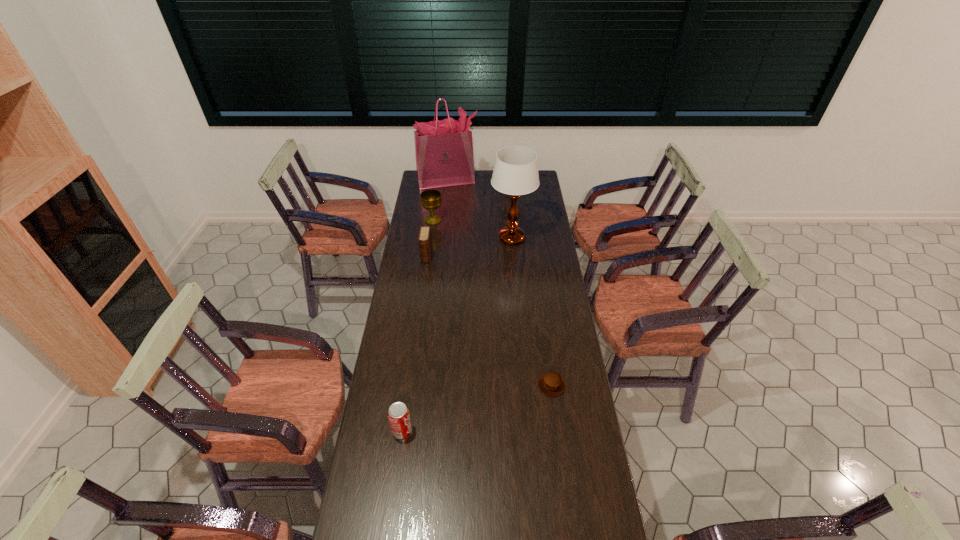
Find the location of a particular element. the farthest object is located at coordinates (444, 156).

Image resolution: width=960 pixels, height=540 pixels. Identify the location of table lamp. (515, 173).

At what (x,y) coordinates should I click in order to perform the action: click on chalice. Please return your answer as a coordinate pair (x, y). This screenshot has width=960, height=540. Looking at the image, I should click on (430, 199).

Identify the location of diary. Image resolution: width=960 pixels, height=540 pixels. (425, 241).

Where is `the nearest object`? The width and height of the screenshot is (960, 540). the nearest object is located at coordinates (399, 418).

This screenshot has height=540, width=960. Identify the location of the fifth farthest object. pyautogui.click(x=552, y=384).

Identify the location of the shortest object. Image resolution: width=960 pixels, height=540 pixels. (552, 384).

Where is `free space located 0.240m on the right of the shopping bag`? free space located 0.240m on the right of the shopping bag is located at coordinates (516, 180).

Identify the location of vacant space situated 0.300m on the front of the table lamp. (516, 294).

Locate an element on the screen. This screenshot has width=960, height=540. vacant space situated 0.110m on the back of the chalice is located at coordinates (435, 204).